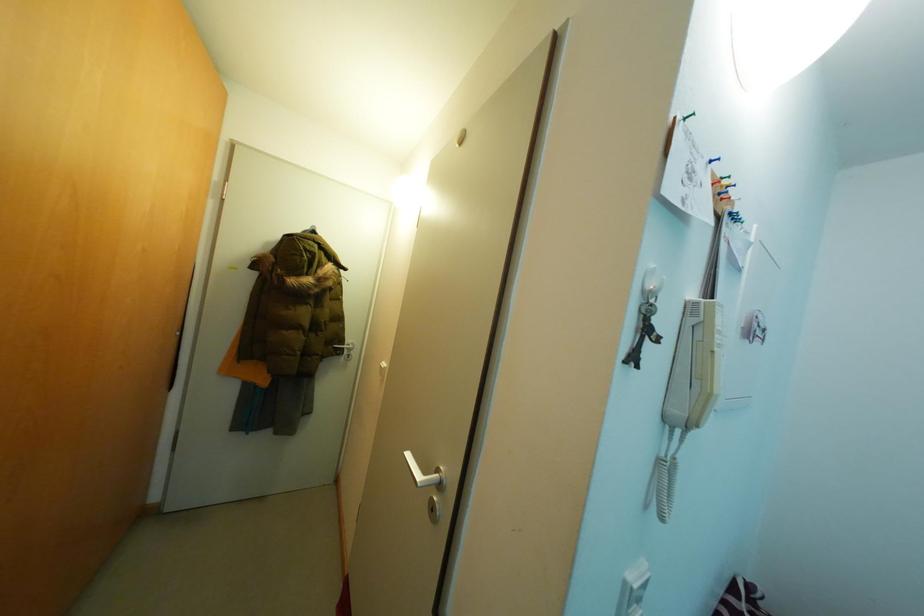
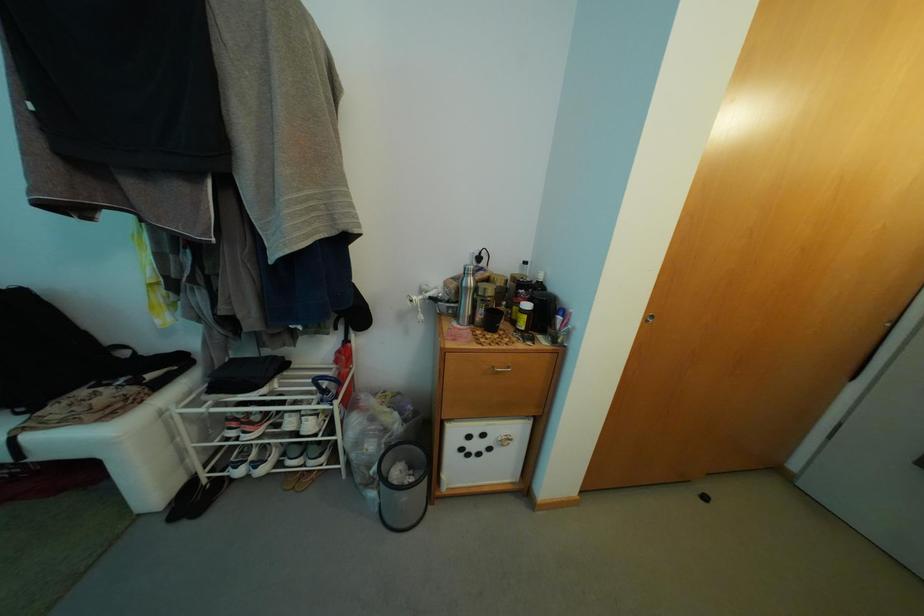
Question: Based on the continuous images, in which direction is the camera rotating? Reply with the corresponding letter.

Choices:
 (A) Left
 (B) Right
 (C) Up
 (D) Down

Answer: (A)